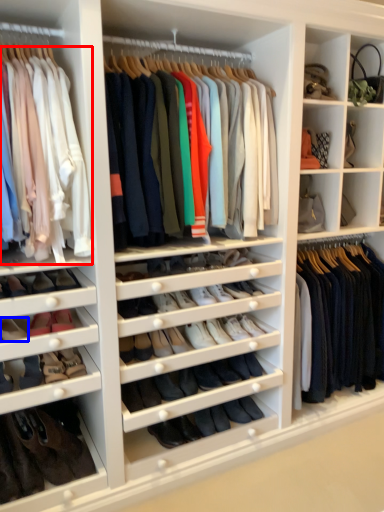
Question: Among these objects, which one is farthest to the camera, clothing (highlighted by a red box) or shoe (highlighted by a blue box)?

Choices:
 (A) clothing
 (B) shoe

Answer: (B)